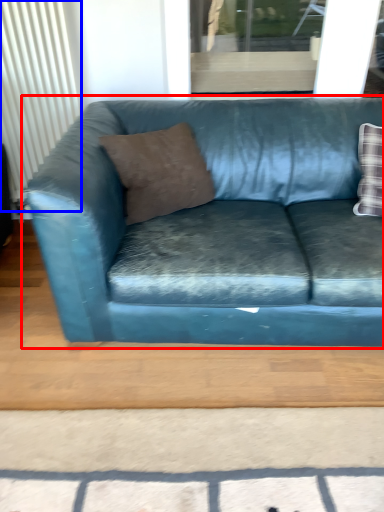
Question: Which object appears closest to the camera in this image, studio couch (highlighted by a red box) or radiator (highlighted by a blue box)?

Choices:
 (A) studio couch
 (B) radiator

Answer: (A)